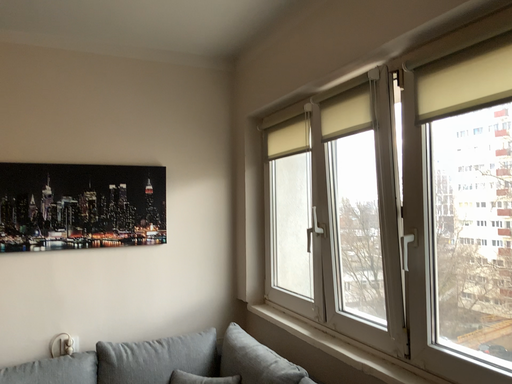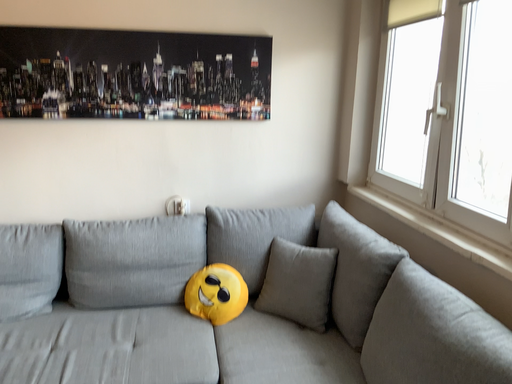
Question: Which way did the camera rotate in the video?

Choices:
 (A) rotated right
 (B) rotated left

Answer: (B)